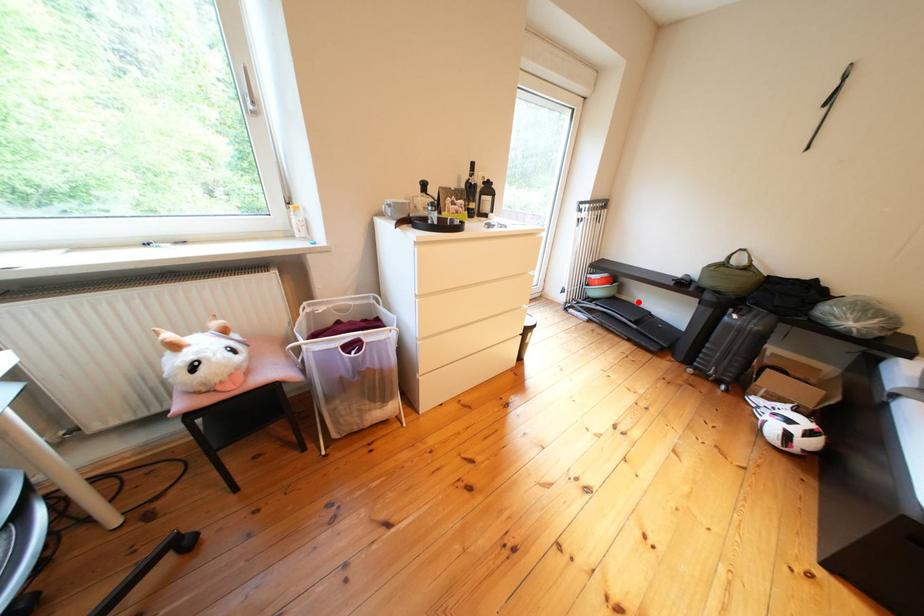
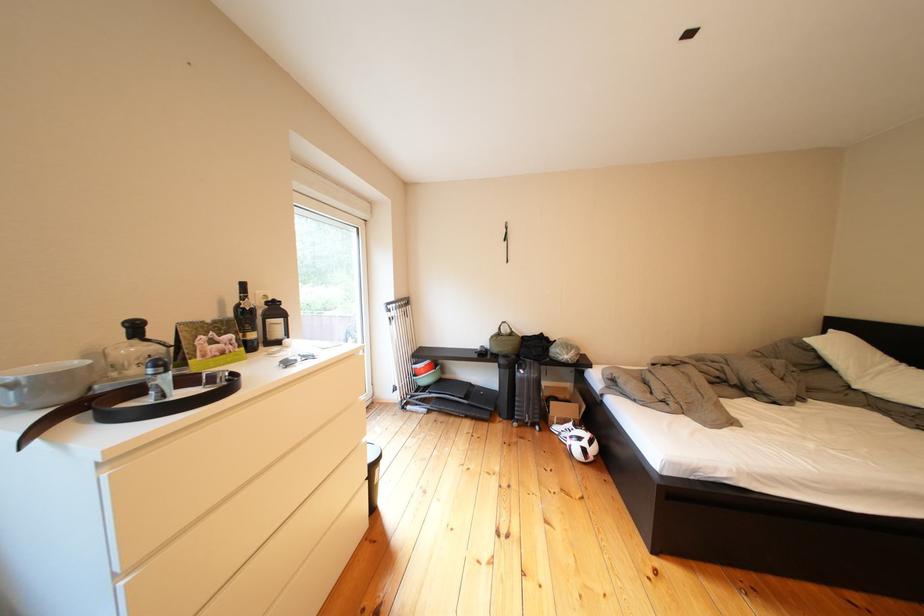
Question: I am providing you with two images of the same scene from different viewpoints. A red point is shown in image1. For the corresponding object point in image2, is it positioned nearer or farther from the camera?

Choices:
 (A) Nearer
 (B) Farther

Answer: (B)